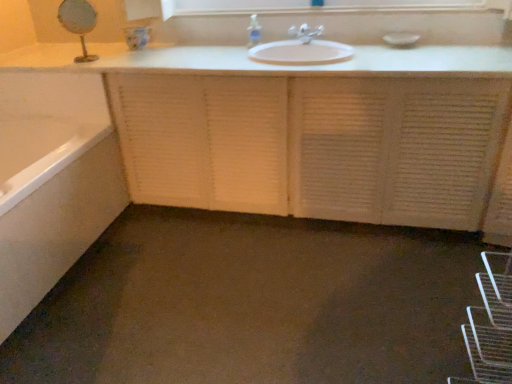
The height and width of the screenshot is (384, 512). Find the location of `vacant area on top of white glossy medicine cabinet at upper center (from a real-world perspective)`. vacant area on top of white glossy medicine cabinet at upper center (from a real-world perspective) is located at coordinates (323, 2).